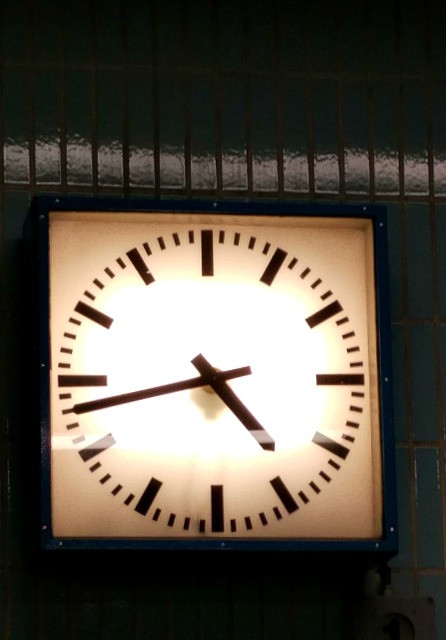
Locate an element on the screen. The height and width of the screenshot is (640, 446). frame is located at coordinates (232, 541), (223, 207), (388, 383), (40, 380).